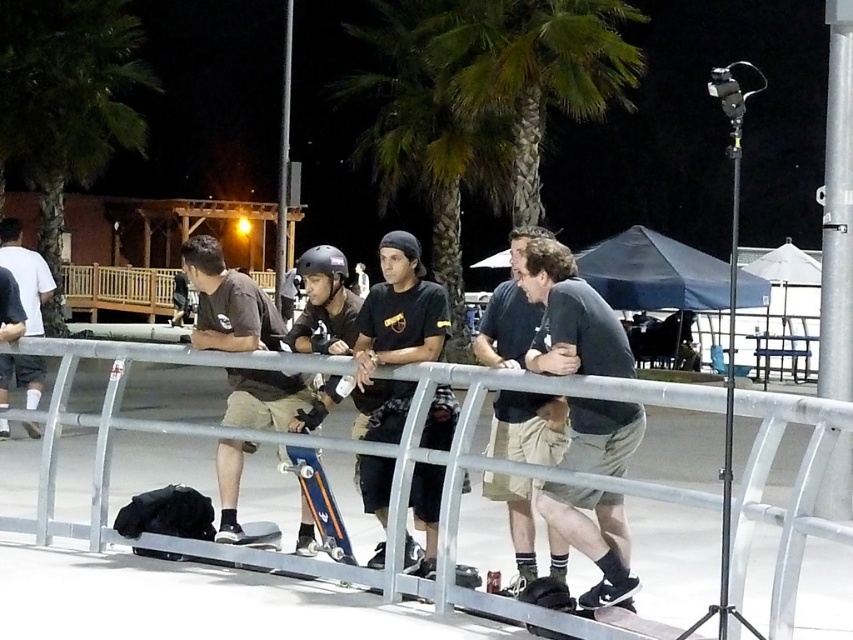
Question: Which object is closer to the camera taking this photo?

Choices:
 (A) dark gray cotton shirt at center
 (B) matte black helmet at center
 (C) black matte skateboard at lower left

Answer: (A)

Question: Considering the real-world distances, which object is farthest from the matte brown helmet at left?

Choices:
 (A) blue metallic skateboard at center
 (B) green leafy palm tree at center
 (C) green leafy palm tree at upper center

Answer: (B)

Question: Does green leafy palm tree at upper center appear on the left side of blue matte skateboard at center?

Choices:
 (A) no
 (B) yes

Answer: (A)

Question: Can you confirm if blue matte skateboard at center is bigger than blue metallic skateboard at center?

Choices:
 (A) no
 (B) yes

Answer: (A)

Question: Where is blue metallic skateboard at center located in relation to matte black helmet at center in the image?

Choices:
 (A) right
 (B) left

Answer: (A)

Question: Which object appears closest to the camera in this image?

Choices:
 (A) blue metallic skateboard at center
 (B) black matte t-shirt at center
 (C) matte brown helmet at left
 (D) matte black helmet at center

Answer: (B)